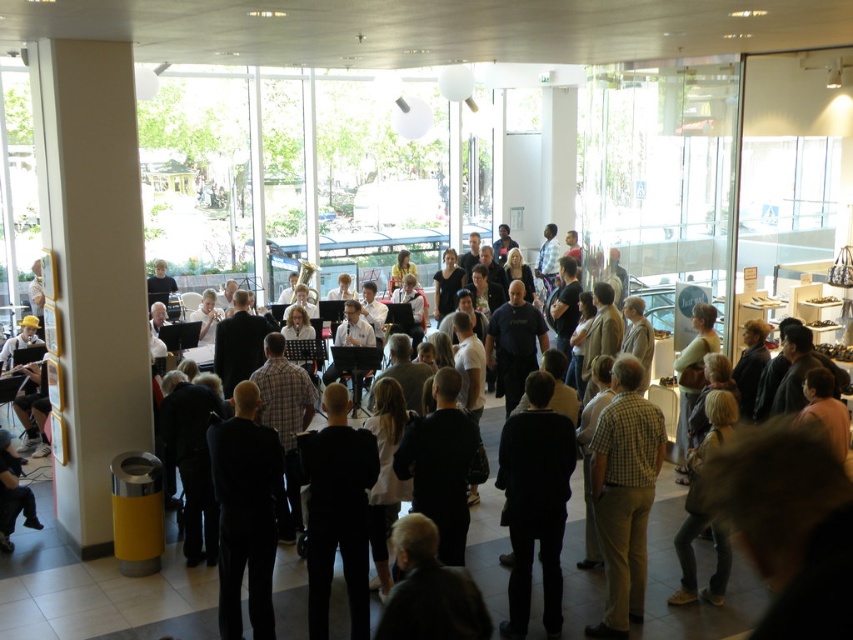
Question: Can you confirm if checkered shirt at center is bigger than dark gray suit at lower left?

Choices:
 (A) yes
 (B) no

Answer: (A)

Question: Considering the real-world distances, which object is closest to the dark gray suit at lower left?

Choices:
 (A) checkered shirt at center
 (B) black suit at center

Answer: (B)

Question: Which object appears farthest from the camera in this image?

Choices:
 (A) dark gray suit at lower left
 (B) checkered shirt at center
 (C) black suit at center

Answer: (A)

Question: Can you confirm if checkered shirt at center is positioned to the right of dark gray suit at lower left?

Choices:
 (A) no
 (B) yes

Answer: (B)

Question: Which point appears farthest from the camera in this image?

Choices:
 (A) (227, 481)
 (B) (3, 468)
 (C) (643, 497)

Answer: (B)

Question: Can you confirm if checkered shirt at center is thinner than black suit at center?

Choices:
 (A) no
 (B) yes

Answer: (A)